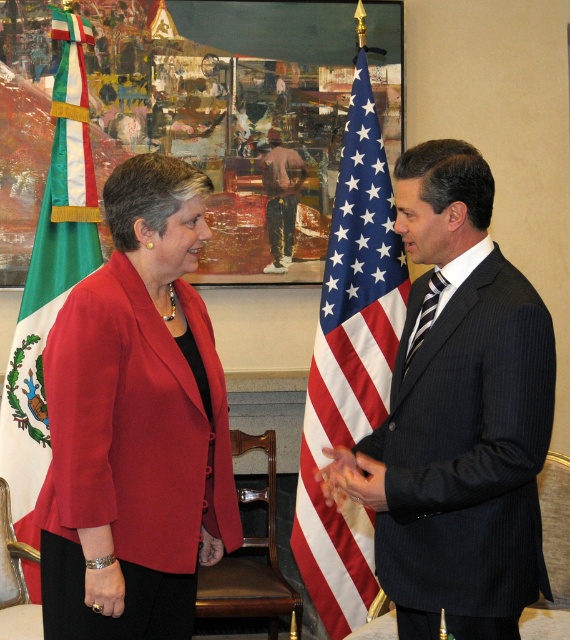
You are an event planner arranging a photo shoot for a diplomatic event. You need to ensure that the green and white fabric flag at left and the pink cotton shirt at center are both visible in the frame. Given their sizes, which object should be placed closer to the camera to maintain their visibility?

The green and white fabric flag at left is larger than the pink cotton shirt at center, so to maintain visibility, the pink cotton shirt at center should be placed closer to the camera since it is smaller and needs to be magnified to match the visibility of the larger flag.

You are a photographer taking a picture of the scene. You want to ensure the pink cotton shirt at center is centered in the frame. Given the current arrangement, will the american flag at center also be centered?

The american flag at center is positioned on the right side of pink cotton shirt at center, so if the pink cotton shirt at center is centered, the american flag at center will be slightly to the right of center.

You are a photographer setting up for a formal portrait. You need to ensure that the dark blue pinstripe suit at center and the smooth skin hand at center are in focus. Given that your camera can only focus on objects within a 25 cm range, will both subjects be in focus?

The distance between the dark blue pinstripe suit at center and the smooth skin hand at center is 28.40 centimeters. Since the camera can only focus within a 25 cm range, the two subjects are slightly out of the required focus range, so they might not both be in focus.